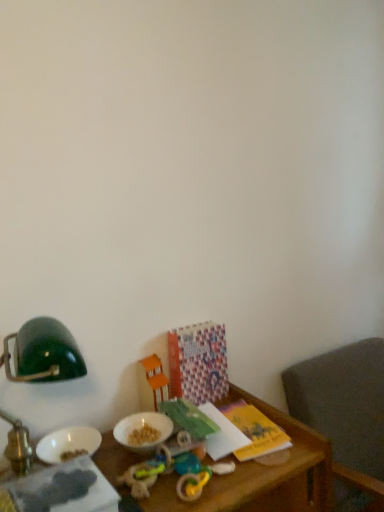
Image resolution: width=384 pixels, height=512 pixels. In order to click on empty space that is to the right of rubber chew toy at lower center, acting as the second toy starting from the back in this screenshot , I will do `click(236, 467)`.